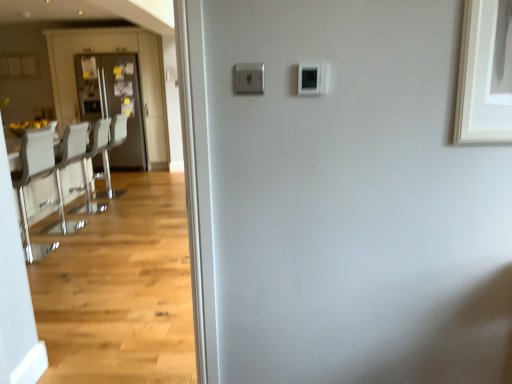
Identify the location of free region under white leather chairs at left (from a real-world perspective). (71, 226).